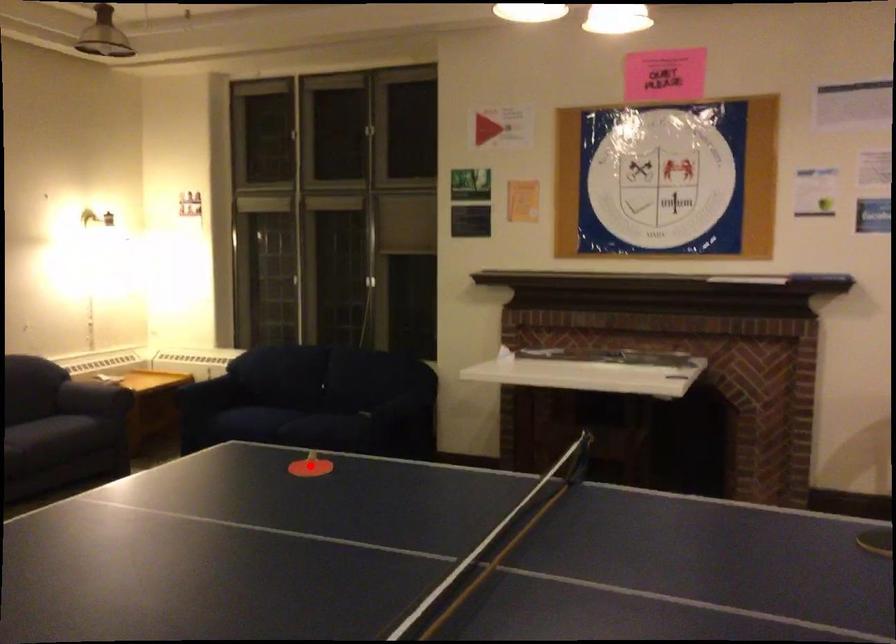
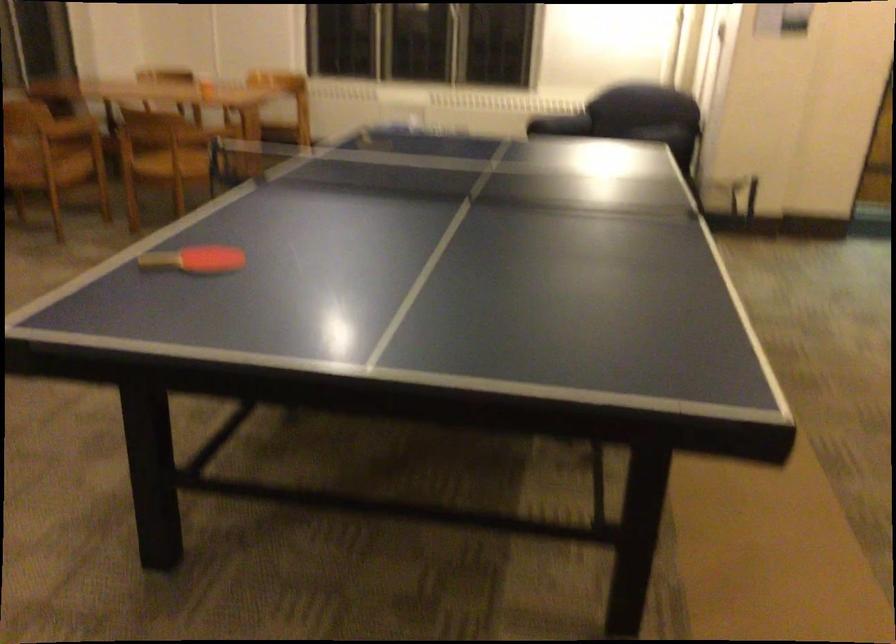
Question: I am providing you with two images of the same scene from different viewpoints. A red point is marked on the first image. Is the red point's position out of view in image 2?

Choices:
 (A) Yes
 (B) No

Answer: (A)